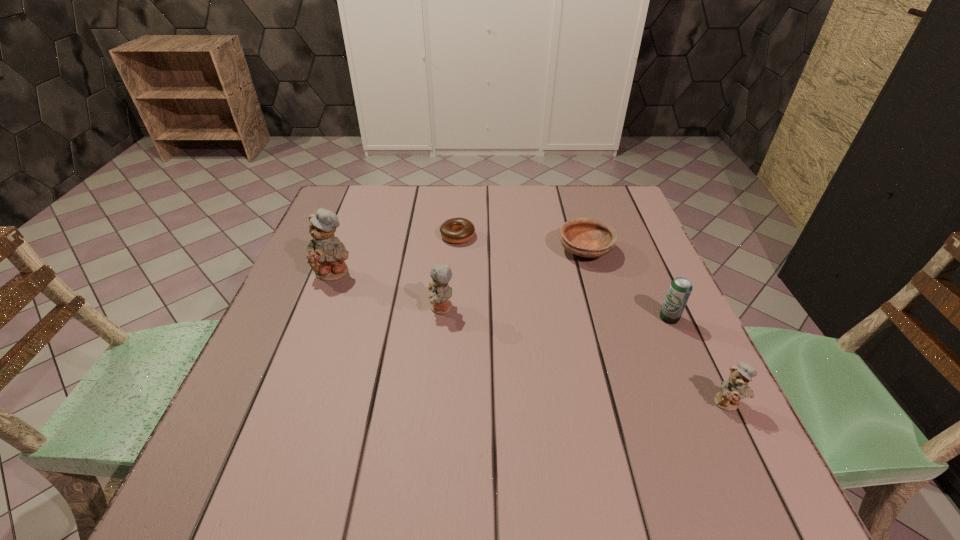
Locate an element on the screen. free space located 0.340m on the front-facing side of the leftmost teddy bear is located at coordinates (284, 406).

Where is `vacant region located on the front-facing side of the second tallest object`? vacant region located on the front-facing side of the second tallest object is located at coordinates (350, 308).

At what (x,y) coordinates should I click in order to perform the action: click on vacant area situated on the front-facing side of the second tallest object. Please return your answer as a coordinate pair (x, y). The image size is (960, 540). Looking at the image, I should click on (350, 308).

Where is `vacant point located 0.090m on the front-facing side of the second tallest object`? The height and width of the screenshot is (540, 960). vacant point located 0.090m on the front-facing side of the second tallest object is located at coordinates point(390,308).

Identify the location of vacant space located on the left of the fifth tallest object. (509, 251).

Where is `vacant space positioned 0.190m on the front of the shortest object`? vacant space positioned 0.190m on the front of the shortest object is located at coordinates (454, 295).

Find the location of a particular element. free space located on the left of the beer can is located at coordinates (561, 318).

Identify the location of object present at the far edge. The width and height of the screenshot is (960, 540). (465, 228).

Where is `object that is at the near edge`? object that is at the near edge is located at coordinates (736, 387).

Where is `object situated at the left edge`? object situated at the left edge is located at coordinates (326, 256).